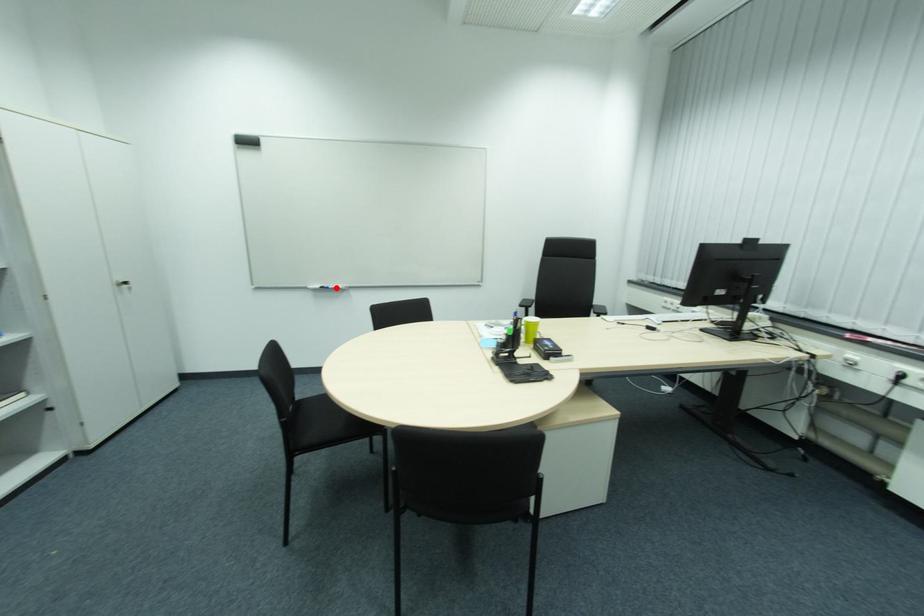
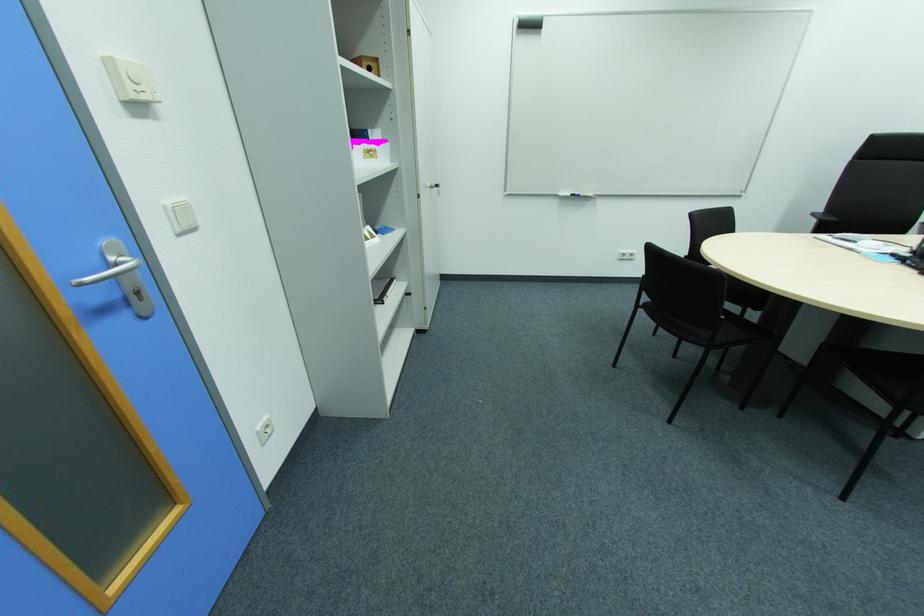
Find the pixel in the second image that matches the highlighted location in the first image.

(588, 195)